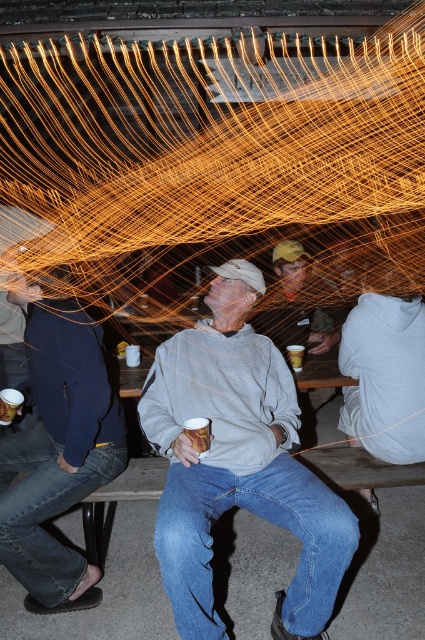
Consider the image. You are at a night picnic and want to grab a drink quickly. Which of the two cups, the white glossy mug at center or the brown paper cup at center, is easier to reach without moving your hand too much?

The white glossy mug at center is easier to reach because it is in front of the brown paper cup at center, making it closer to your hand.

You are a waiter at a night picnic and need to place a new cup between the white glossy mug at center and the brown paper cup at center. The cup you have is 1.2 feet wide. Can you fit it there without moving the existing cups?

The distance between the white glossy mug at center and brown paper cup at center is 3.70 feet. Since the new cup is only 1.2 feet wide, there is enough space to place it between them without moving the existing cups.